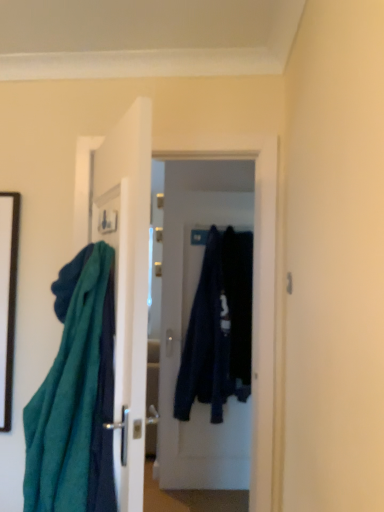
Question: Is black matte picture frame at left not inside dark blue fabric at center, positioned as the 1th door in back-to-front order?

Choices:
 (A) no
 (B) yes

Answer: (B)

Question: From a real-world perspective, is black matte picture frame at left over dark blue fabric at center, marked as the first door in a right-to-left arrangement?

Choices:
 (A) no
 (B) yes

Answer: (B)

Question: Is black matte picture frame at left placed right next to dark blue fabric at center, marked as the first door in a right-to-left arrangement?

Choices:
 (A) no
 (B) yes

Answer: (A)

Question: Does black matte picture frame at left appear on the left side of dark blue fabric at center, placed as the 2th door when sorted from left to right?

Choices:
 (A) yes
 (B) no

Answer: (A)

Question: Is black matte picture frame at left smaller than dark blue fabric at center, placed as the 2th door when sorted from left to right?

Choices:
 (A) yes
 (B) no

Answer: (A)

Question: Would you say black matte picture frame at left is a long distance from dark blue fabric at center, positioned as the 1th door in back-to-front order?

Choices:
 (A) no
 (B) yes

Answer: (B)

Question: Is dark blue fabric at center, which appears as the second clothing when viewed from the left, surrounding black matte picture frame at left?

Choices:
 (A) no
 (B) yes

Answer: (A)

Question: Considering the relative sizes of dark blue fabric at center, which appears as the second clothing when viewed from the left, and black matte picture frame at left in the image provided, is dark blue fabric at center, which appears as the second clothing when viewed from the left, wider than black matte picture frame at left?

Choices:
 (A) yes
 (B) no

Answer: (A)

Question: Is dark blue fabric at center, which ranks as the first clothing in right-to-left order, further to the viewer compared to black matte picture frame at left?

Choices:
 (A) yes
 (B) no

Answer: (A)

Question: Is dark blue fabric at center, which appears as the second clothing when viewed from the left, facing away from black matte picture frame at left?

Choices:
 (A) no
 (B) yes

Answer: (A)

Question: Can you confirm if dark blue fabric at center, which ranks as the first clothing in right-to-left order, is smaller than black matte picture frame at left?

Choices:
 (A) no
 (B) yes

Answer: (A)

Question: Is dark blue fabric at center, which ranks as the first clothing in right-to-left order, thinner than black matte picture frame at left?

Choices:
 (A) yes
 (B) no

Answer: (B)

Question: Does dark blue fabric at center, which appears as the 1th clothing when viewed from the left, turn towards dark blue fabric at center, which ranks as the first clothing in right-to-left order?

Choices:
 (A) yes
 (B) no

Answer: (B)